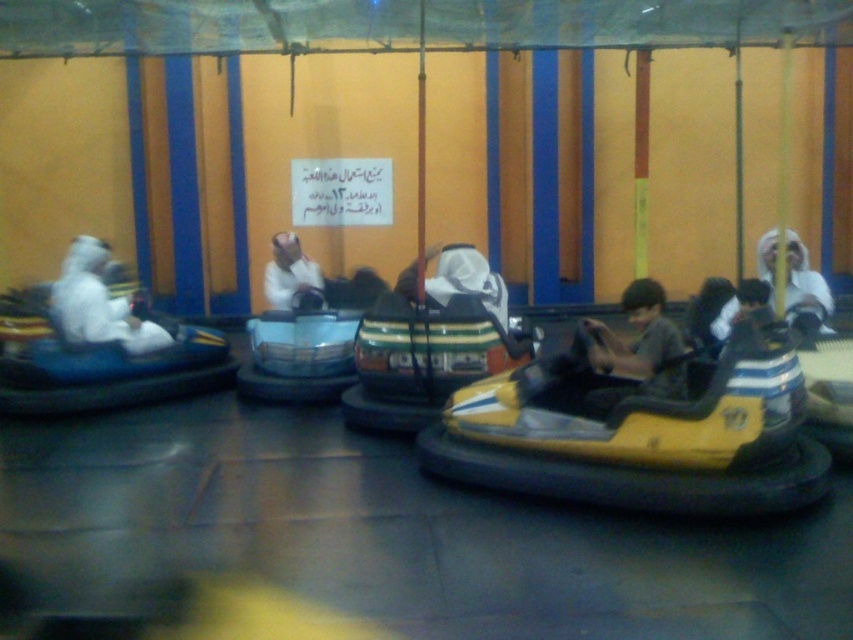
Is point (706, 403) positioned behind point (672, 348)?

No, it is not.

Does yellow matte bumper car at center have a smaller size compared to matte yellow bumper car at center?

Actually, yellow matte bumper car at center might be larger than matte yellow bumper car at center.

Where is `yellow matte bumper car at center`? The height and width of the screenshot is (640, 853). yellow matte bumper car at center is located at coordinates (640, 432).

This screenshot has width=853, height=640. Identify the location of yellow matte bumper car at center. (640, 432).

Which is in front, point (74, 243) or point (263, 285)?

Positioned in front is point (74, 243).

Is white matte helmet at left below white matte headscarf at center?

Indeed, white matte helmet at left is positioned under white matte headscarf at center.

Where is `white matte helmet at left`? white matte helmet at left is located at coordinates (97, 301).

Identify the location of white matte helmet at left. (97, 301).

Identify the location of white matte headscarf at upper right. The height and width of the screenshot is (640, 853). (804, 291).

This screenshot has width=853, height=640. I want to click on white matte headscarf at upper right, so click(804, 291).